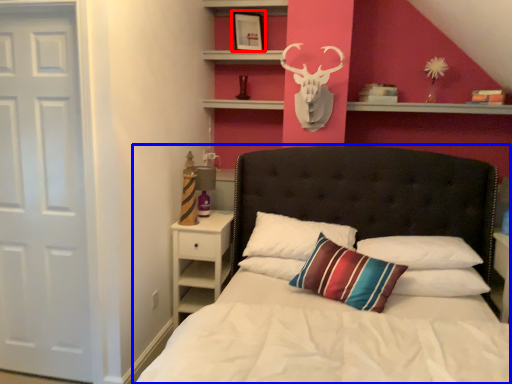
Question: Which object is further to the camera taking this photo, picture frame (highlighted by a red box) or bed (highlighted by a blue box)?

Choices:
 (A) picture frame
 (B) bed

Answer: (A)